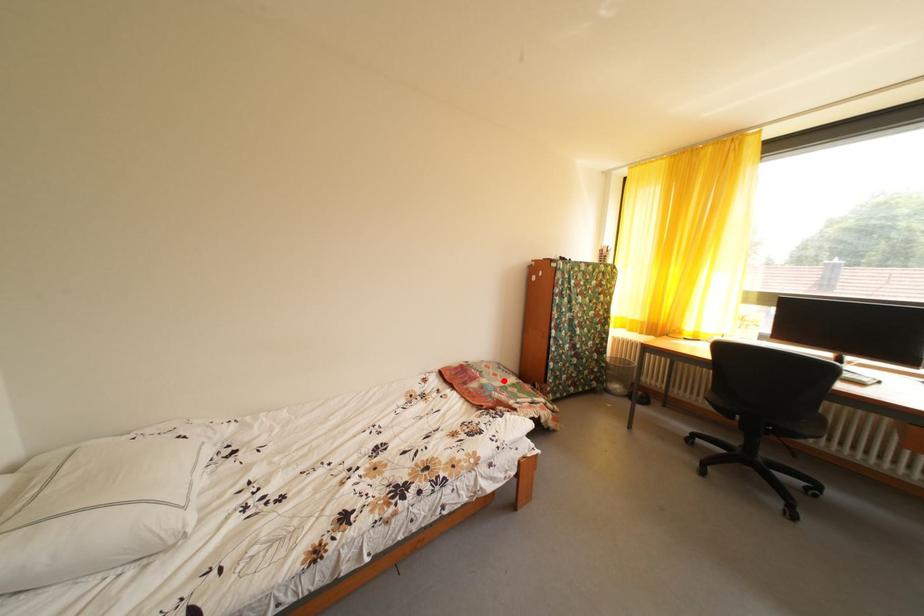
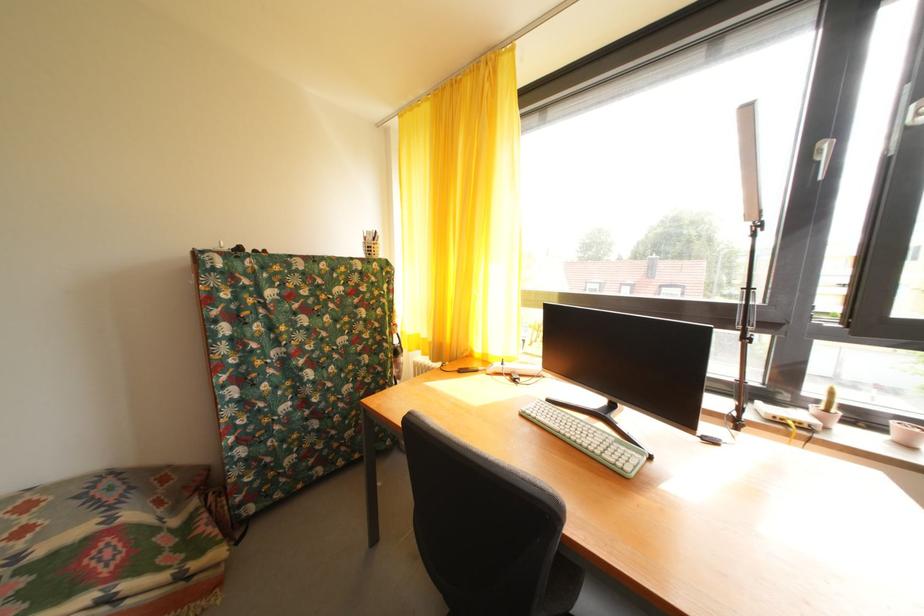
Question: A red point is marked in image1. In image2, is the corresponding 3D point closer to the camera or farther? Reply with the corresponding letter.

Choices:
 (A) The corresponding 3D point is closer.
 (B) The corresponding 3D point is farther.

Answer: (A)